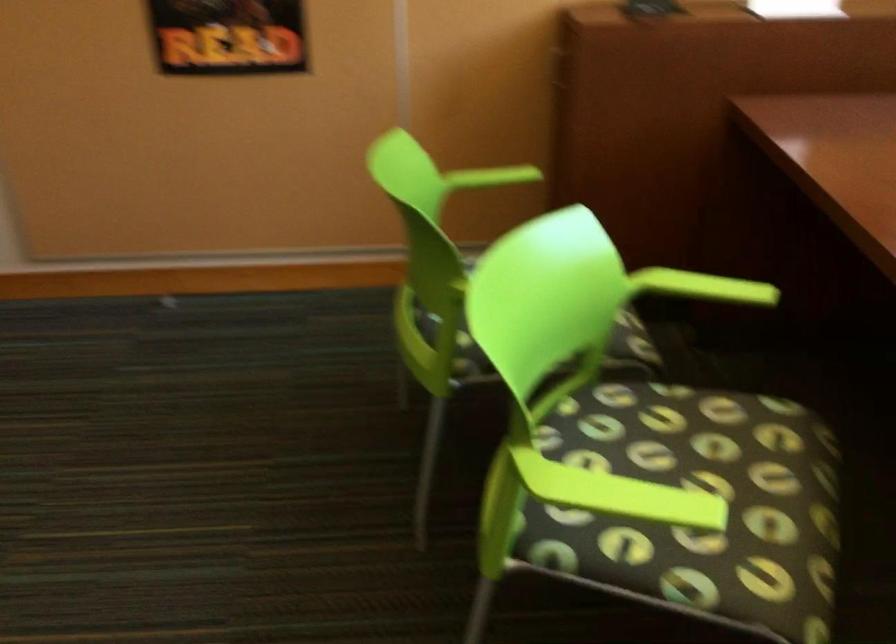
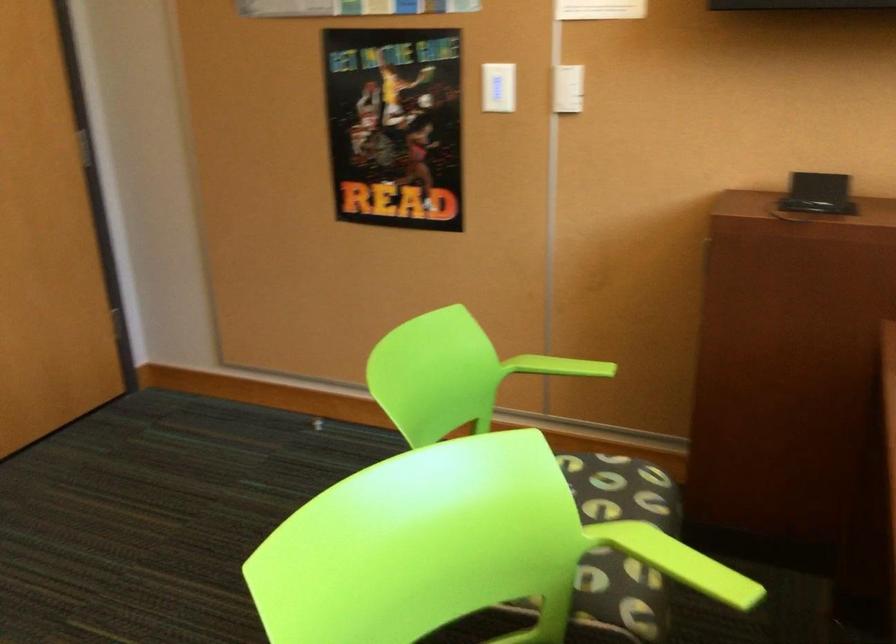
Locate, in the second image, the point that corresponds to point (488, 176) in the first image.

(558, 366)